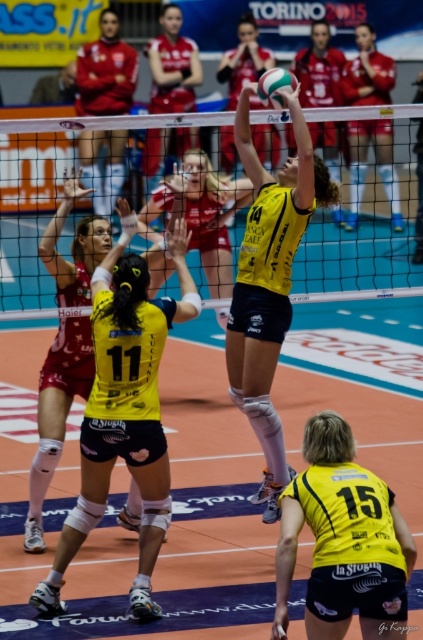
Who is higher up, black mesh net at center or yellow matte/vinyl volleyball player at center?

black mesh net at center is higher up.

Which is in front, point (359, 214) or point (266, 356)?

Point (266, 356) is more forward.

Locate an element on the screen. This screenshot has height=640, width=423. black mesh net at center is located at coordinates (365, 225).

Looking at this image, is matte red uniform at upper center thinner than yellow matte volleyball at center?

Indeed, matte red uniform at upper center has a lesser width compared to yellow matte volleyball at center.

Is point (150, 109) closer to viewer compared to point (252, 26)?

Yes, it is.

Which is in front, point (183, 99) or point (233, 76)?

Positioned in front is point (183, 99).

The width and height of the screenshot is (423, 640). What are the coordinates of `matte red uniform at upper center` in the screenshot? It's located at [173, 65].

Does yellow matte volleyball at center come behind white matte volleyball at center?

Yes, it is behind white matte volleyball at center.

Between yellow matte volleyball at center and white matte volleyball at center, which one has less height?

white matte volleyball at center is shorter.

Describe the element at coordinates (244, 60) in the screenshot. I see `yellow matte volleyball at center` at that location.

The width and height of the screenshot is (423, 640). I want to click on yellow matte volleyball at center, so click(244, 60).